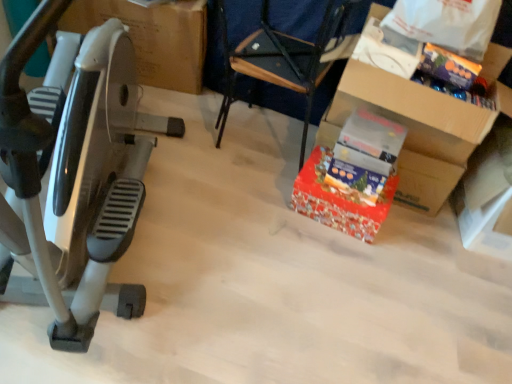
This screenshot has width=512, height=384. Find the location of `free space underneath blue fabric armchair at center (from a real-world perspective)`. free space underneath blue fabric armchair at center (from a real-world perspective) is located at coordinates (268, 149).